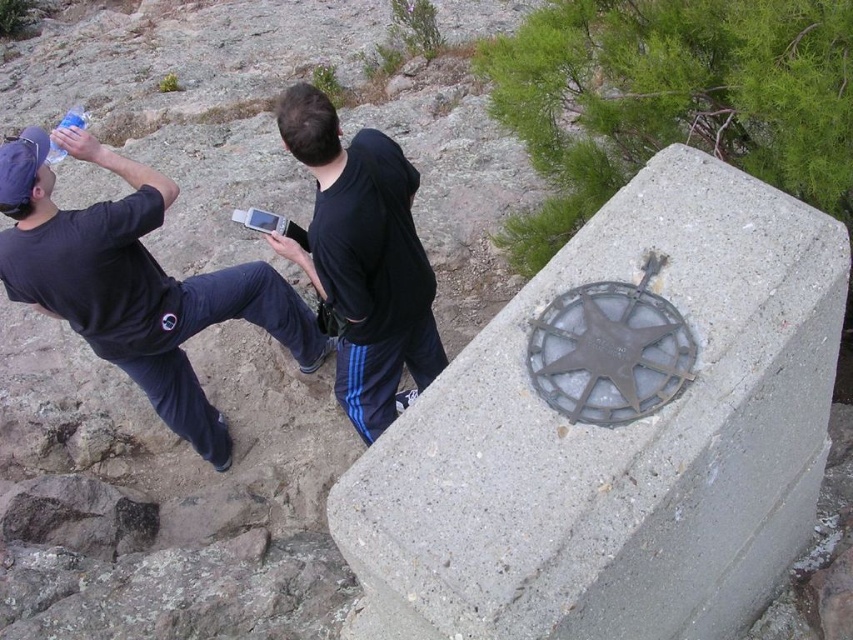
Can you confirm if gray concrete at right is thinner than black matte hoodie at center?

In fact, gray concrete at right might be wider than black matte hoodie at center.

Consider the image. Between gray concrete at right and black matte hoodie at center, which one appears on the left side from the viewer's perspective?

black matte hoodie at center is more to the left.

Measure the distance between point (491, 348) and camera.

Point (491, 348) and camera are 2.34 meters apart from each other.

The height and width of the screenshot is (640, 853). I want to click on gray concrete at right, so click(x=616, y=440).

Is matte black t-shirt at left to the right of translucent plastic bottle at upper left from the viewer's perspective?

Correct, you'll find matte black t-shirt at left to the right of translucent plastic bottle at upper left.

Identify the location of matte black t-shirt at left. (134, 282).

Is matte black t-shirt at left behind black matte hoodie at center?

Yes, matte black t-shirt at left is further from the viewer.

Does matte black t-shirt at left have a larger size compared to black matte hoodie at center?

Correct, matte black t-shirt at left is larger in size than black matte hoodie at center.

Measure the distance between point (207, 310) and camera.

Point (207, 310) is 4.29 meters from camera.

This screenshot has height=640, width=853. What are the coordinates of `matte black t-shirt at left` in the screenshot? It's located at (134, 282).